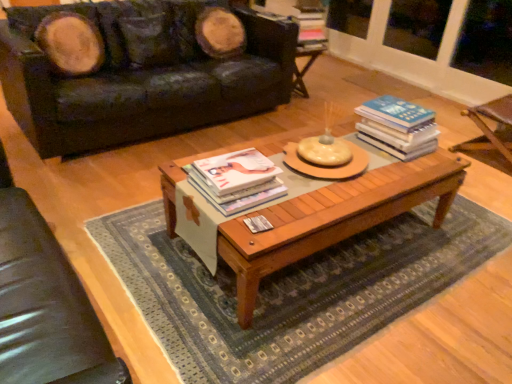
You are a GUI agent. You are given a task and a screenshot of the screen. Output one action in this format:
    pyautogui.click(x=<x>, y=<y>)
    Task: Click on the vacant space in front of hardcover book at center, which is the second book in front-to-back order
    Image resolution: width=512 pixels, height=384 pixels.
    Given the screenshot: What is the action you would take?
    pyautogui.click(x=398, y=170)